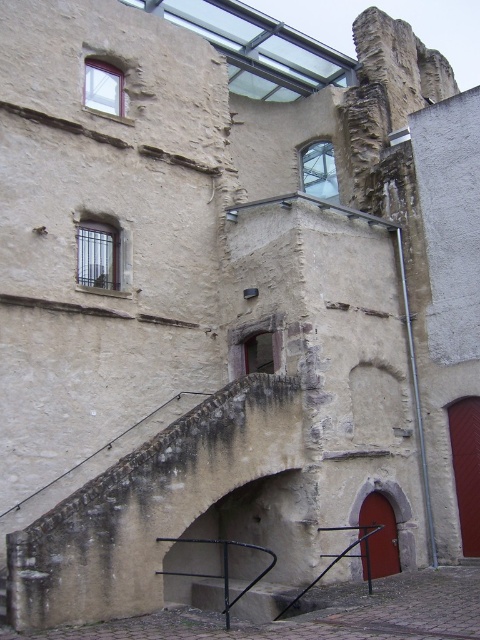
Question: Among these points, which one is nearest to the camera?

Choices:
 (A) (359, 556)
 (B) (268, 563)

Answer: (A)

Question: Can you confirm if black metal/rail at lower center is thinner than black metal rail at lower center?

Choices:
 (A) yes
 (B) no

Answer: (A)

Question: Among these objects, which one is nearest to the camera?

Choices:
 (A) black metal rail at lower center
 (B) black metal/rail at lower center

Answer: (B)

Question: Can you confirm if black metal/rail at lower center is positioned below black metal rail at lower center?

Choices:
 (A) no
 (B) yes

Answer: (A)

Question: Is black metal/rail at lower center smaller than black metal rail at lower center?

Choices:
 (A) yes
 (B) no

Answer: (B)